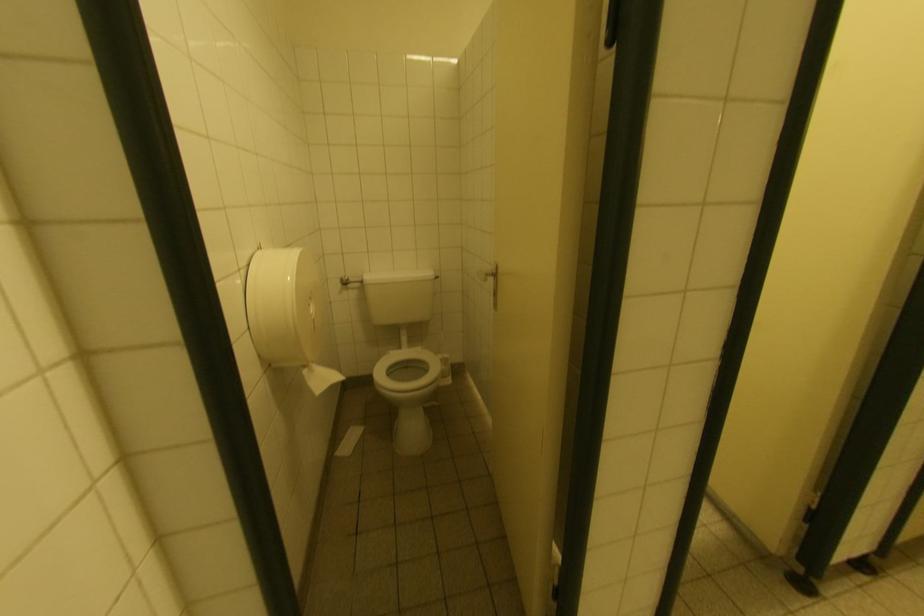
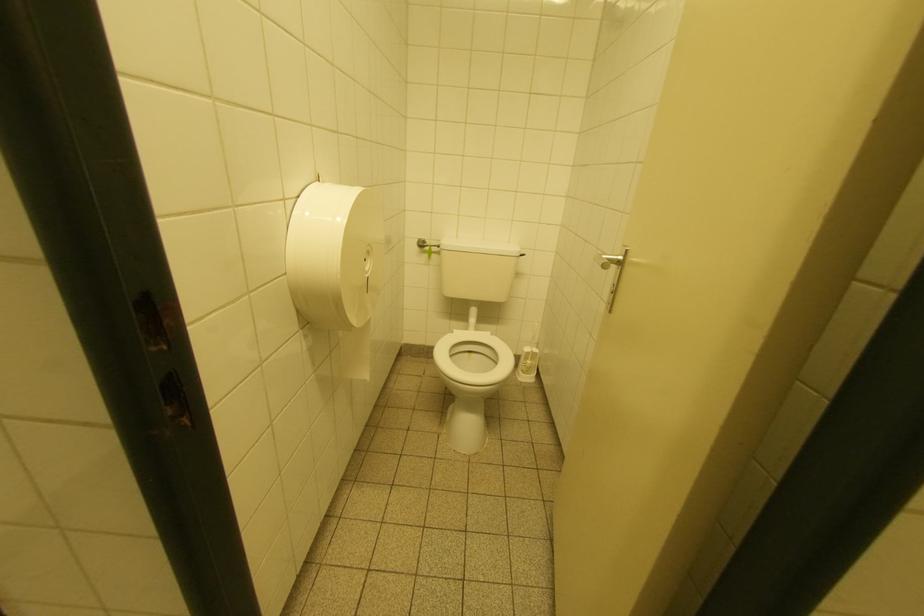
Question: The camera is either moving clockwise (left) or counter-clockwise (right) around the object. The first image is from the beginning of the video and the second image is from the end. Is the camera moving left or right when shooting the video?

Choices:
 (A) Left
 (B) Right

Answer: (B)